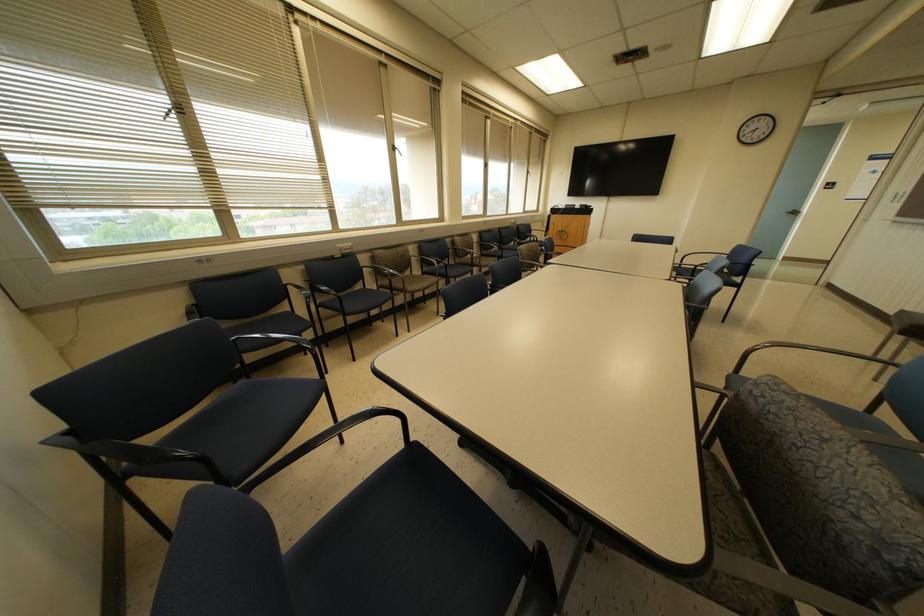
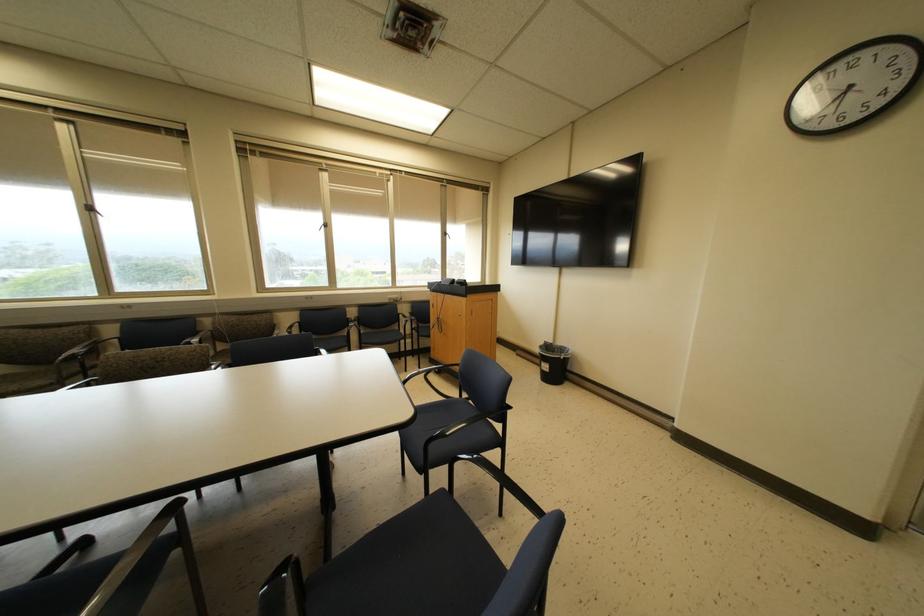
In the second image, find the point that corresponds to pixel 527 172 in the first image.

(444, 233)